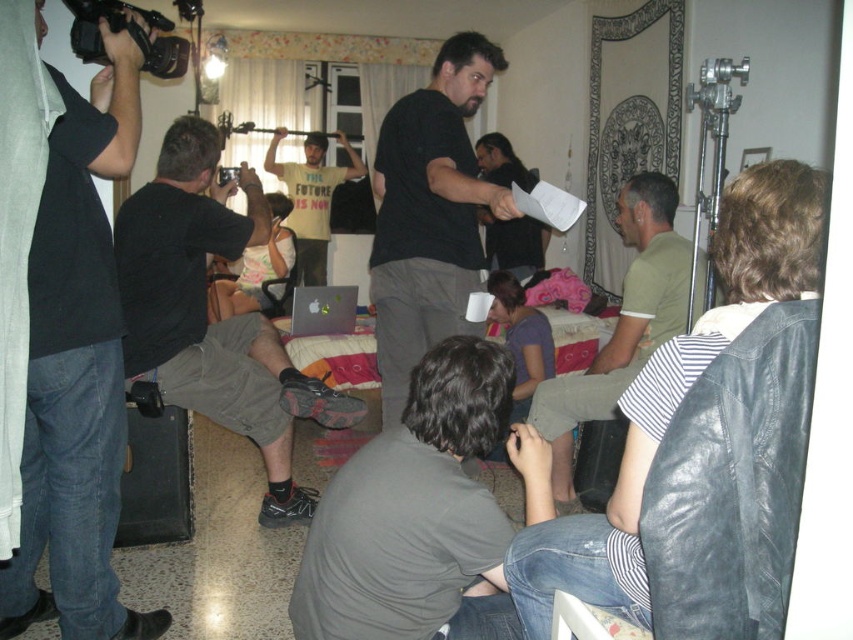
Question: Can you confirm if matte black shirt at center is positioned to the left of matte silver laptop at center?

Choices:
 (A) yes
 (B) no

Answer: (B)

Question: Can you confirm if black matte shirt at center is thinner than black plastic video camera at upper left?

Choices:
 (A) no
 (B) yes

Answer: (A)

Question: Considering the real-world distances, which object is closest to the yellow t-shirt at center?

Choices:
 (A) gray matte shirt at lower center
 (B) leather jacket at center
 (C) black plastic video camera at upper center

Answer: (C)

Question: Considering the real-world distances, which object is farthest from the green cotton shirt at center?

Choices:
 (A) black plastic video camera at upper center
 (B) black matte shirt at center
 (C) matte black shirt at center
 (D) dark gray jeans at left

Answer: (C)

Question: Can you confirm if gray matte shirt at lower center is positioned above green cotton shirt at center?

Choices:
 (A) no
 (B) yes

Answer: (A)

Question: Which point is farther to the camera?

Choices:
 (A) black plastic video camera at upper center
 (B) matte black shirt at center

Answer: (B)